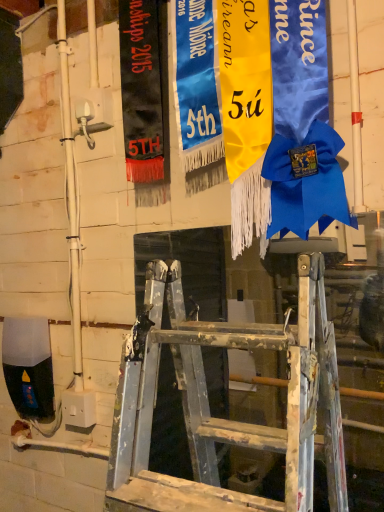
Question: Is blue satin ribbon at upper center, marked as the second tapestry in a left-to-right arrangement, beside black fabric banner at upper left, marked as the 1th tapestry in a left-to-right arrangement?

Choices:
 (A) yes
 (B) no

Answer: (B)

Question: From the image's perspective, is blue satin ribbon at upper center, marked as the second tapestry in a left-to-right arrangement, below black fabric banner at upper left, arranged as the 3th tapestry when viewed from the right?

Choices:
 (A) yes
 (B) no

Answer: (A)

Question: Is blue satin ribbon at upper center, marked as the second tapestry in a left-to-right arrangement, outside of black fabric banner at upper left, arranged as the 3th tapestry when viewed from the right?

Choices:
 (A) no
 (B) yes

Answer: (B)

Question: Is blue satin ribbon at upper center, marked as the second tapestry in a left-to-right arrangement, taller than black fabric banner at upper left, arranged as the 3th tapestry when viewed from the right?

Choices:
 (A) no
 (B) yes

Answer: (A)

Question: From a real-world perspective, does blue satin ribbon at upper center, marked as the 2th tapestry in a right-to-left arrangement, stand above black fabric banner at upper left, marked as the 1th tapestry in a left-to-right arrangement?

Choices:
 (A) no
 (B) yes

Answer: (A)

Question: Is blue satin ribbon at upper center, marked as the second tapestry in a left-to-right arrangement, far away from black fabric banner at upper left, arranged as the 3th tapestry when viewed from the right?

Choices:
 (A) no
 (B) yes

Answer: (A)

Question: From the image's perspective, is yellow satin ribbon at center, which ranks as the first tapestry in right-to-left order, beneath black fabric banner at upper left, arranged as the 3th tapestry when viewed from the right?

Choices:
 (A) no
 (B) yes

Answer: (B)

Question: Does yellow satin ribbon at center, which ranks as the first tapestry in right-to-left order, appear on the right side of black fabric banner at upper left, marked as the 1th tapestry in a left-to-right arrangement?

Choices:
 (A) no
 (B) yes

Answer: (B)

Question: Does yellow satin ribbon at center, which ranks as the first tapestry in right-to-left order, have a greater height compared to black fabric banner at upper left, marked as the 1th tapestry in a left-to-right arrangement?

Choices:
 (A) yes
 (B) no

Answer: (A)

Question: Can you confirm if yellow satin ribbon at center, marked as the third tapestry in a left-to-right arrangement, is bigger than black fabric banner at upper left, marked as the 1th tapestry in a left-to-right arrangement?

Choices:
 (A) yes
 (B) no

Answer: (A)

Question: From a real-world perspective, is yellow satin ribbon at center, which ranks as the first tapestry in right-to-left order, over black fabric banner at upper left, marked as the 1th tapestry in a left-to-right arrangement?

Choices:
 (A) no
 (B) yes

Answer: (A)

Question: Considering the relative positions of yellow satin ribbon at center, which ranks as the first tapestry in right-to-left order, and black fabric banner at upper left, marked as the 1th tapestry in a left-to-right arrangement, in the image provided, is yellow satin ribbon at center, which ranks as the first tapestry in right-to-left order, to the left of black fabric banner at upper left, marked as the 1th tapestry in a left-to-right arrangement, from the viewer's perspective?

Choices:
 (A) yes
 (B) no

Answer: (B)

Question: Is there a large distance between blue satin ribbon at upper center, marked as the second tapestry in a left-to-right arrangement, and yellow satin ribbon at center, which ranks as the first tapestry in right-to-left order?

Choices:
 (A) no
 (B) yes

Answer: (A)